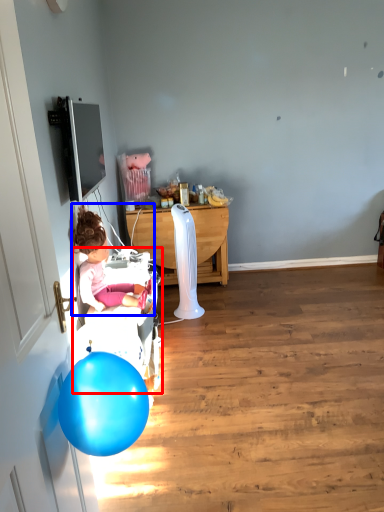
Question: Which of the following is the closest to the observer, baby carriage (highlighted by a red box) or person (highlighted by a blue box)?

Choices:
 (A) baby carriage
 (B) person

Answer: (B)